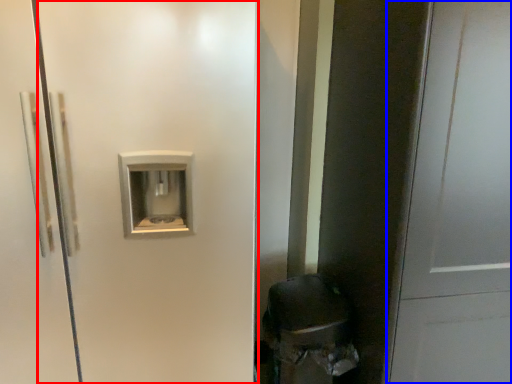
Question: Which point is closer to the camera, screen door (highlighted by a red box) or door (highlighted by a blue box)?

Choices:
 (A) screen door
 (B) door

Answer: (B)